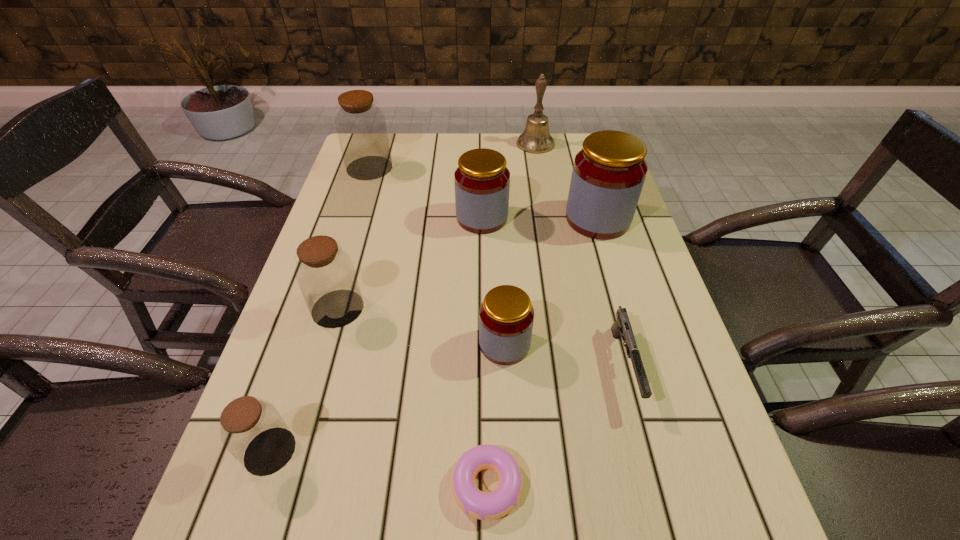
Where is `the farthest object`? The height and width of the screenshot is (540, 960). the farthest object is located at coordinates (536, 138).

Locate an element on the screen. The height and width of the screenshot is (540, 960). the second farthest object is located at coordinates (361, 128).

Where is `the biggest brown jar`? This screenshot has height=540, width=960. the biggest brown jar is located at coordinates (361, 128).

Locate an element on the screen. Image resolution: width=960 pixels, height=540 pixels. the rightmost jar is located at coordinates click(608, 175).

Identify the location of the rightmost red jar. (608, 175).

Where is `the second farthest brown jar`? This screenshot has width=960, height=540. the second farthest brown jar is located at coordinates (325, 274).

You are a GUI agent. You are given a task and a screenshot of the screen. Output one action in this format:
    pyautogui.click(x=<x>, y=<y>)
    Task: Click on the second smallest red jar
    This screenshot has width=960, height=540.
    Given the screenshot: What is the action you would take?
    pyautogui.click(x=482, y=181)

This screenshot has width=960, height=540. I want to click on the smallest red jar, so click(x=506, y=316).

Image resolution: width=960 pixels, height=540 pixels. Identify the location of the nearest brown jar. (252, 430).

What are the coordinates of `the nearest jar` in the screenshot? It's located at (252, 430).